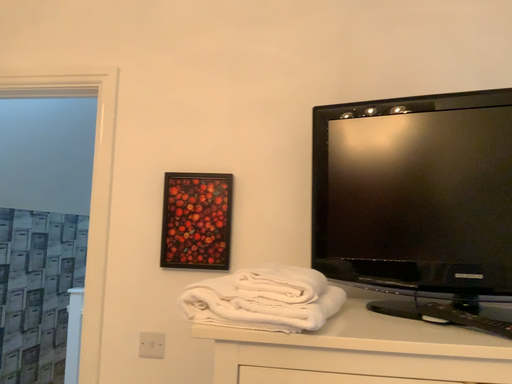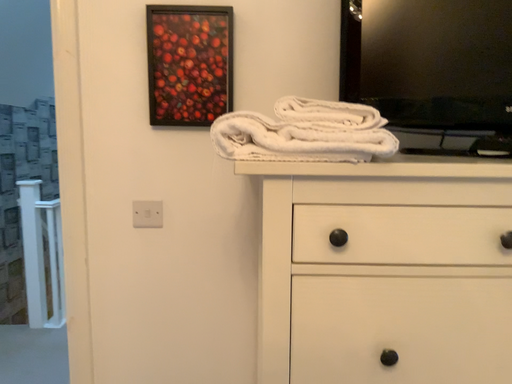
Question: Which way did the camera rotate in the video?

Choices:
 (A) rotated downward
 (B) rotated upward

Answer: (A)